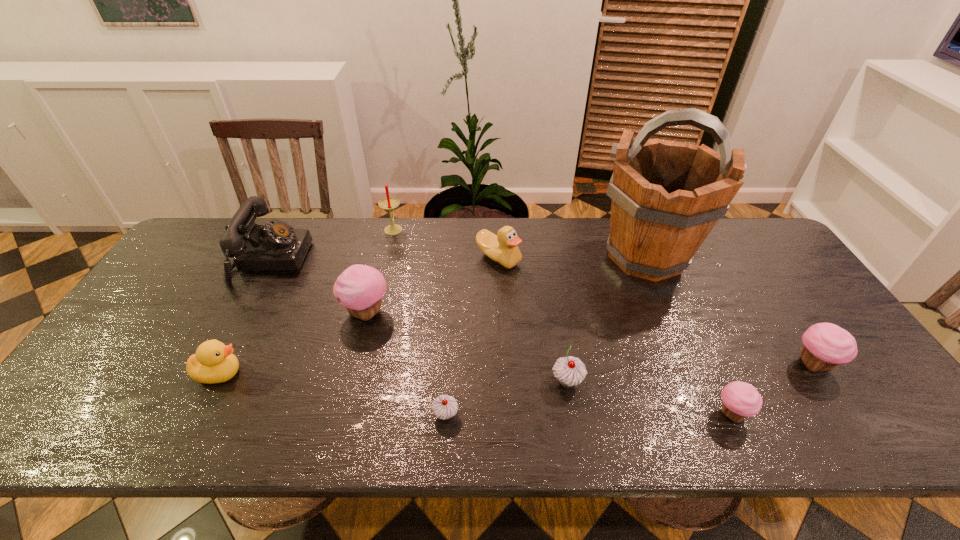
Image resolution: width=960 pixels, height=540 pixels. Identify the location of free space in the image that satisfies the following two spatial constraints: 1. on the face of the yellow duckling; 2. on the back side of the sixth object from right to left. (199, 415).

You are a GUI agent. You are given a task and a screenshot of the screen. Output one action in this format:
    pyautogui.click(x=<x>, y=<y>)
    Task: Click on the free location that satisfies the following two spatial constraints: 1. on the front side of the bucket; 2. on the right side of the nearest pink cupcake
    The width and height of the screenshot is (960, 540).
    Given the screenshot: What is the action you would take?
    pyautogui.click(x=712, y=414)

Find the location of a particular element. The width and height of the screenshot is (960, 540). free point that satisfies the following two spatial constraints: 1. on the back side of the right gray cupcake; 2. on the right side of the smaller gray cupcake is located at coordinates [x=447, y=381].

Image resolution: width=960 pixels, height=540 pixels. Find the location of `vacant space that satisfies the following two spatial constraints: 1. on the back side of the smallest pink cupcake; 2. on the face of the yellow duckling`. vacant space that satisfies the following two spatial constraints: 1. on the back side of the smallest pink cupcake; 2. on the face of the yellow duckling is located at coordinates (713, 373).